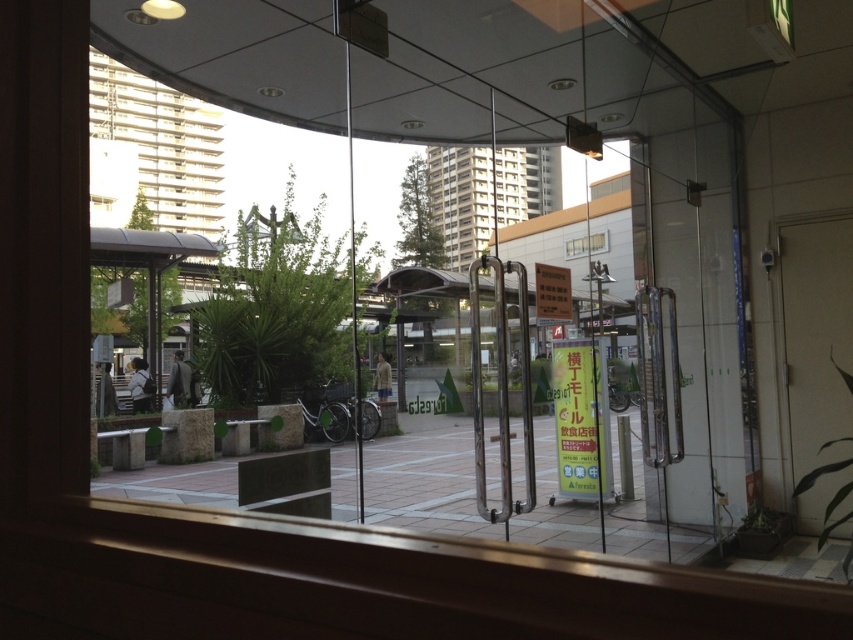
Question: Which point is farther from the camera taking this photo?

Choices:
 (A) (219, 180)
 (B) (585, 250)
 (C) (706, 449)

Answer: (B)

Question: Which object is the closest to the transparent glass door at center?

Choices:
 (A) clear glass window at center
 (B) transparent glass window at center
 (C) transparent glass window at upper left

Answer: (B)

Question: Does transparent glass window at upper left lie behind clear glass window at center?

Choices:
 (A) yes
 (B) no

Answer: (B)

Question: Does transparent glass window at center have a larger size compared to clear glass window at center?

Choices:
 (A) no
 (B) yes

Answer: (B)

Question: Can you confirm if transparent glass door at center is bigger than transparent glass window at center?

Choices:
 (A) no
 (B) yes

Answer: (A)

Question: Which is nearer to the transparent glass window at upper left?

Choices:
 (A) clear glass window at center
 (B) transparent glass window at center

Answer: (B)